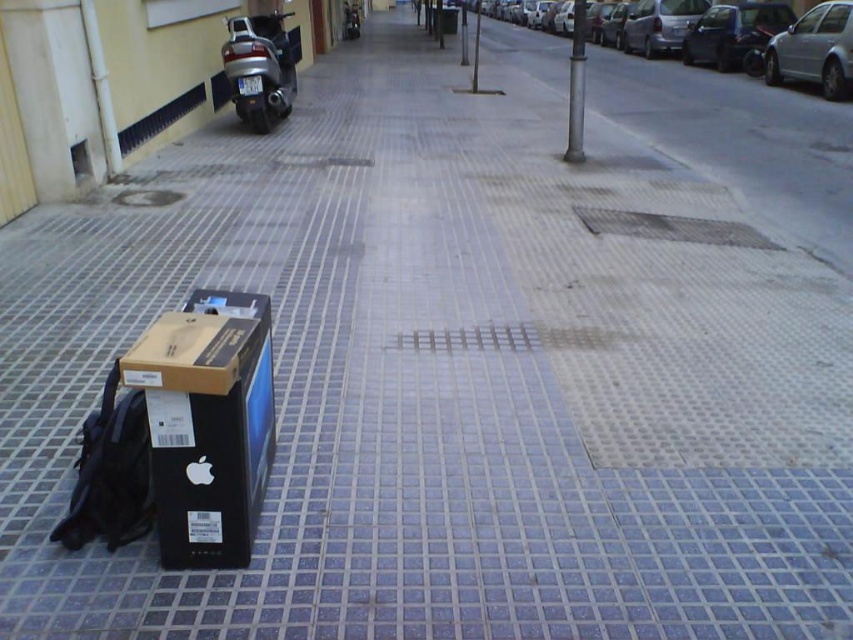
You are a delivery person trying to park your bike between the silver metallic sedan at right and the silver metallic pole at center. Based on their positions, which side of the pole should you place your bike to avoid blocking the sedan?

The silver metallic sedan at right is to the right of the silver metallic pole at center, so you should place your bike to the left of the silver metallic pole at center to avoid blocking the sedan.

You are a delivery person who needs to park your 36 inch wide motorcycle between the metallic silver car at right and the silver metallic van at center right. Is there enough space for your motorcycle between them?

The metallic silver car at right and silver metallic van at center right are 37.47 inches apart from each other. Since your motorcycle is 36 inches wide, there is enough space for it between them.

You are standing at the origin point in the image. The coordinates given are in a normalized system where the bottom left corner is the origin. Can you determine which object is located at point [732,29]?

The point [732,29] corresponds to the metallic silver car at right.